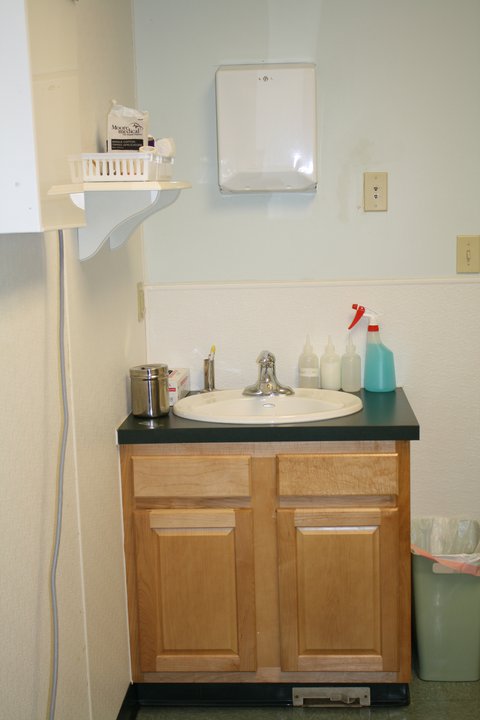
You are a GUI agent. You are given a task and a screenshot of the screen. Output one action in this format:
    pyautogui.click(x=<x>, y=<y>)
    Task: Click on the basket
    Image resolution: width=480 pixels, height=720 pixels.
    Given the screenshot: What is the action you would take?
    pyautogui.click(x=137, y=171)